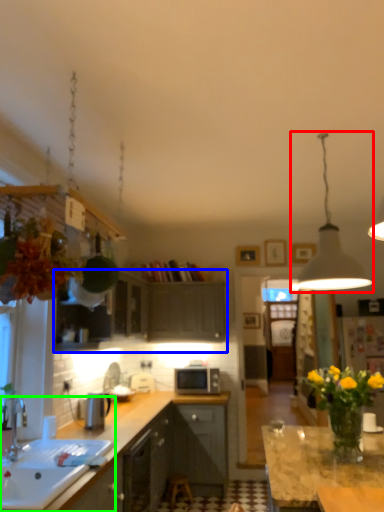
Question: Estimate the real-world distances between objects in this image. Which object is farther from light fixture (highlighted by a red box), cabinetry (highlighted by a blue box) or sink (highlighted by a green box)?

Choices:
 (A) cabinetry
 (B) sink

Answer: (A)